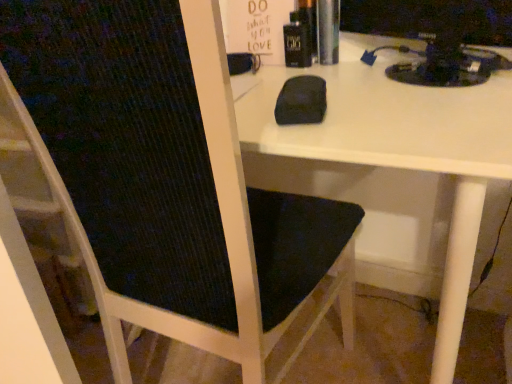
Find the location of a particular element. This screenshot has height=384, width=512. free spot in front of black plastic monitor at upper right is located at coordinates (419, 114).